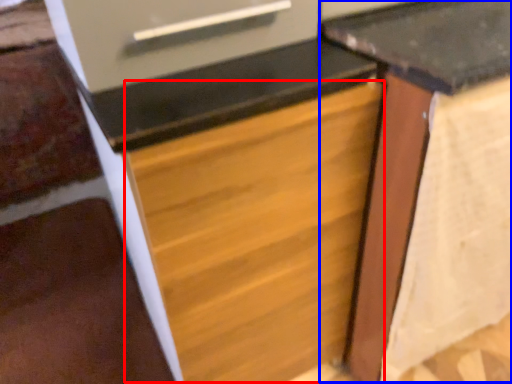
Question: Which of the following is the closest to the observer, drawer (highlighted by a red box) or table (highlighted by a blue box)?

Choices:
 (A) drawer
 (B) table

Answer: (A)